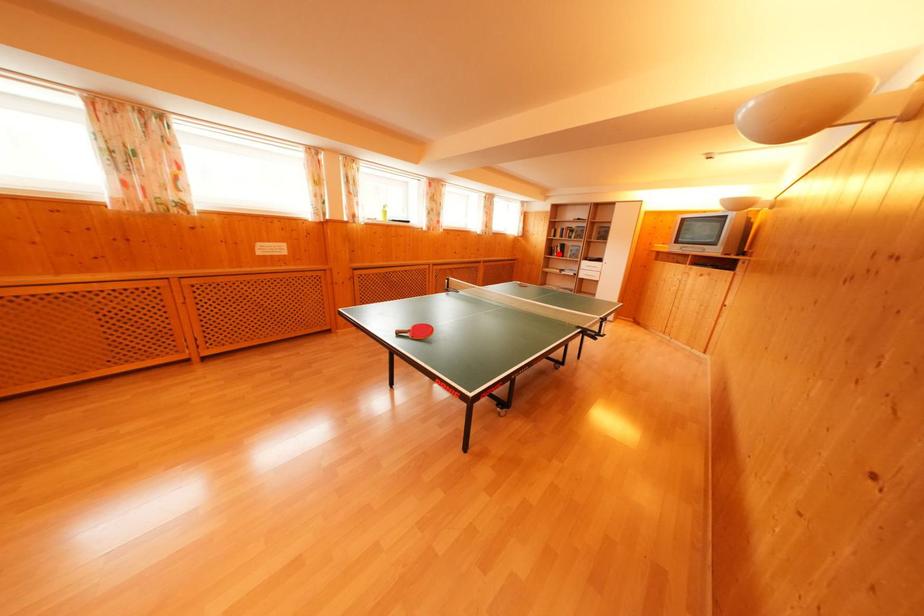
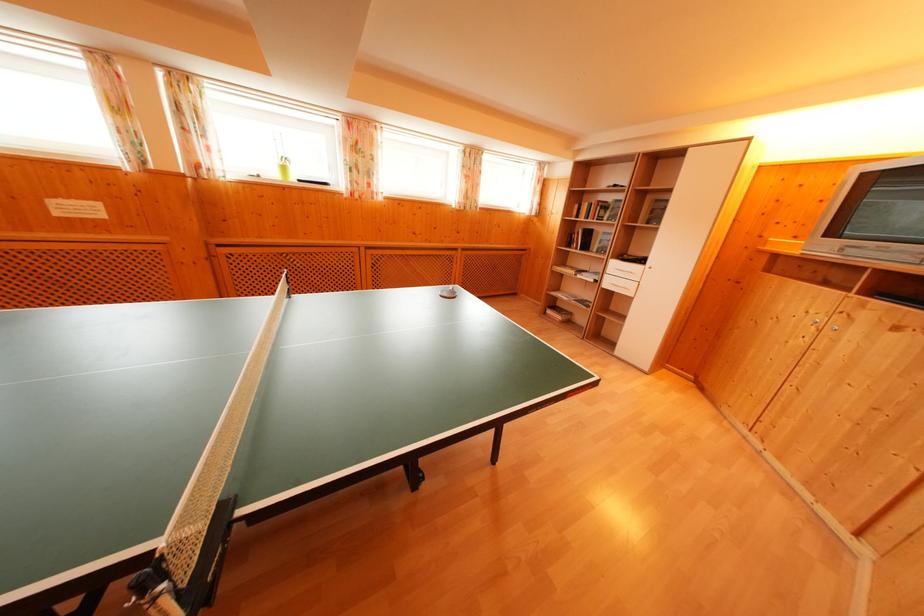
Find the pixel in the second image that matches the highlighted location in the first image.

(580, 241)